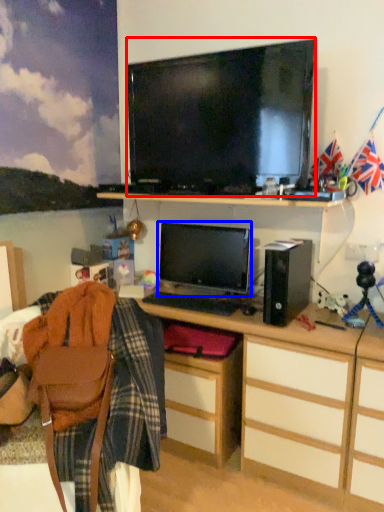
Question: Which object is further to the camera taking this photo, television (highlighted by a red box) or computer monitor (highlighted by a blue box)?

Choices:
 (A) television
 (B) computer monitor

Answer: (B)